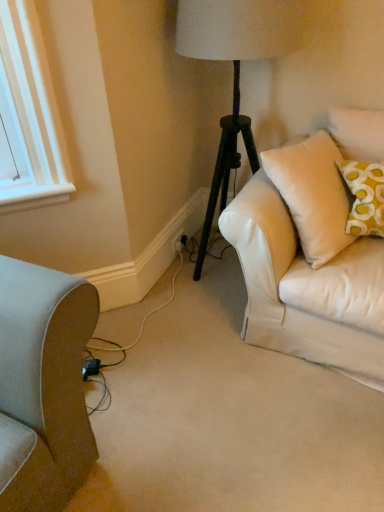
Describe the element at coordinates (180, 243) in the screenshot. This screenshot has width=384, height=512. I see `black plastic electric outlet at lower center` at that location.

This screenshot has width=384, height=512. In order to click on black plastic electric outlet at lower center in this screenshot , I will do `click(180, 243)`.

Locate an element on the screen. black plastic electric outlet at lower center is located at coordinates (180, 243).